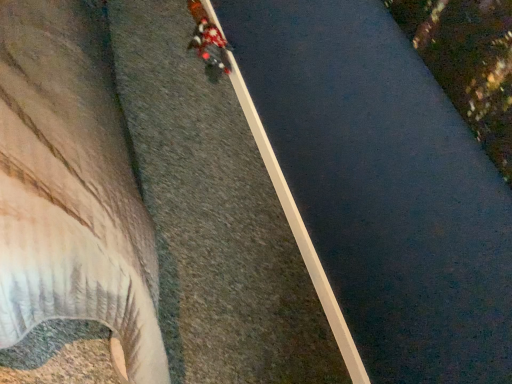
What do you see at coordinates (208, 38) in the screenshot?
I see `red fabric jacket at upper center` at bounding box center [208, 38].

Where is `red fabric jacket at upper center`? red fabric jacket at upper center is located at coordinates (208, 38).

The width and height of the screenshot is (512, 384). What do you see at coordinates (383, 187) in the screenshot?
I see `smooth concrete waterway at center` at bounding box center [383, 187].

Measure the distance between point (454, 215) and camera.

Point (454, 215) is 89.30 centimeters from camera.

I want to click on smooth concrete waterway at center, so click(383, 187).

This screenshot has height=384, width=512. I want to click on red fabric jacket at upper center, so click(208, 38).

Is red fabric jacket at upper center at the right side of smooth concrete waterway at center?

Incorrect, red fabric jacket at upper center is not on the right side of smooth concrete waterway at center.

In the image, is red fabric jacket at upper center positioned in front of or behind smooth concrete waterway at center?

Clearly, red fabric jacket at upper center is behind smooth concrete waterway at center.

Which is further, [193,43] or [391,65]?

Positioned behind is point [193,43].

From the image's perspective, is red fabric jacket at upper center located beneath smooth concrete waterway at center?

Incorrect, from the image's perspective, red fabric jacket at upper center is higher than smooth concrete waterway at center.

From a real-world perspective, is red fabric jacket at upper center positioned above or below smooth concrete waterway at center?

From a real-world perspective, red fabric jacket at upper center is physically above smooth concrete waterway at center.

Consider the image. Looking at their sizes, would you say red fabric jacket at upper center is wider or thinner than smooth concrete waterway at center?

red fabric jacket at upper center is wider than smooth concrete waterway at center.

Considering the sizes of objects red fabric jacket at upper center and smooth concrete waterway at center in the image provided, who is shorter, red fabric jacket at upper center or smooth concrete waterway at center?

Standing shorter between the two is smooth concrete waterway at center.

Consider the image. Who is smaller, red fabric jacket at upper center or smooth concrete waterway at center?

smooth concrete waterway at center.

Would you say red fabric jacket at upper center contains smooth concrete waterway at center?

No, smooth concrete waterway at center is not inside red fabric jacket at upper center.

Are red fabric jacket at upper center and smooth concrete waterway at center making contact?

No, red fabric jacket at upper center is not with smooth concrete waterway at center.

Is red fabric jacket at upper center oriented towards smooth concrete waterway at center?

No, red fabric jacket at upper center is not facing towards smooth concrete waterway at center.

What's the angular difference between red fabric jacket at upper center and smooth concrete waterway at center's facing directions?

The angular difference between red fabric jacket at upper center and smooth concrete waterway at center is 2.73 degrees.

How much distance is there between red fabric jacket at upper center and smooth concrete waterway at center?

37.74 inches.

This screenshot has height=384, width=512. Find the location of `person behind the smooth concrete waterway at center`. person behind the smooth concrete waterway at center is located at coordinates (208, 38).

Considering the positions of objects smooth concrete waterway at center and red fabric jacket at upper center in the image provided, who is more to the left, smooth concrete waterway at center or red fabric jacket at upper center?

red fabric jacket at upper center.

Does smooth concrete waterway at center come in front of red fabric jacket at upper center?

That is True.

Is point (379, 323) behind point (200, 23)?

No.

From the image's perspective, is smooth concrete waterway at center beneath red fabric jacket at upper center?

Yes, from the image's perspective, smooth concrete waterway at center is below red fabric jacket at upper center.

From a real-world perspective, is smooth concrete waterway at center positioned over red fabric jacket at upper center based on gravity?

Incorrect, from a real-world perspective, smooth concrete waterway at center is lower than red fabric jacket at upper center.

Consider the image. Is smooth concrete waterway at center wider than red fabric jacket at upper center?

No, smooth concrete waterway at center is not wider than red fabric jacket at upper center.

Which of these two, smooth concrete waterway at center or red fabric jacket at upper center, stands taller?

With more height is red fabric jacket at upper center.

Between smooth concrete waterway at center and red fabric jacket at upper center, which one has larger size?

With larger size is red fabric jacket at upper center.

Can red fabric jacket at upper center be found inside smooth concrete waterway at center?

That's incorrect, red fabric jacket at upper center is not inside smooth concrete waterway at center.

Is smooth concrete waterway at center directly adjacent to red fabric jacket at upper center?

There is a gap between smooth concrete waterway at center and red fabric jacket at upper center.

Is smooth concrete waterway at center looking in the opposite direction of red fabric jacket at upper center?

smooth concrete waterway at center is not turned away from red fabric jacket at upper center.

The width and height of the screenshot is (512, 384). I want to click on person that appears on the left of smooth concrete waterway at center, so click(x=208, y=38).

In the image, there is a smooth concrete waterway at center. Where is `person above it (from the image's perspective)`? Image resolution: width=512 pixels, height=384 pixels. person above it (from the image's perspective) is located at coordinates (208, 38).

This screenshot has height=384, width=512. I want to click on person behind the smooth concrete waterway at center, so click(208, 38).